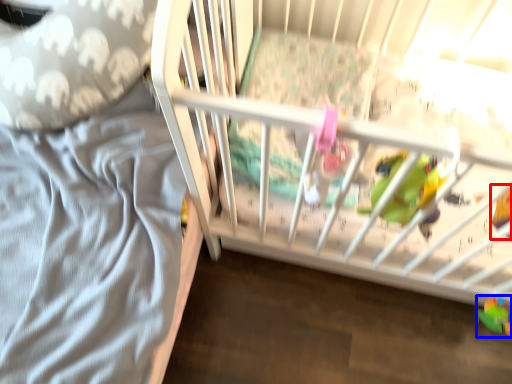
Question: Which of the following is the closest to the observer, toy (highlighted by a red box) or toy (highlighted by a blue box)?

Choices:
 (A) toy
 (B) toy

Answer: (A)